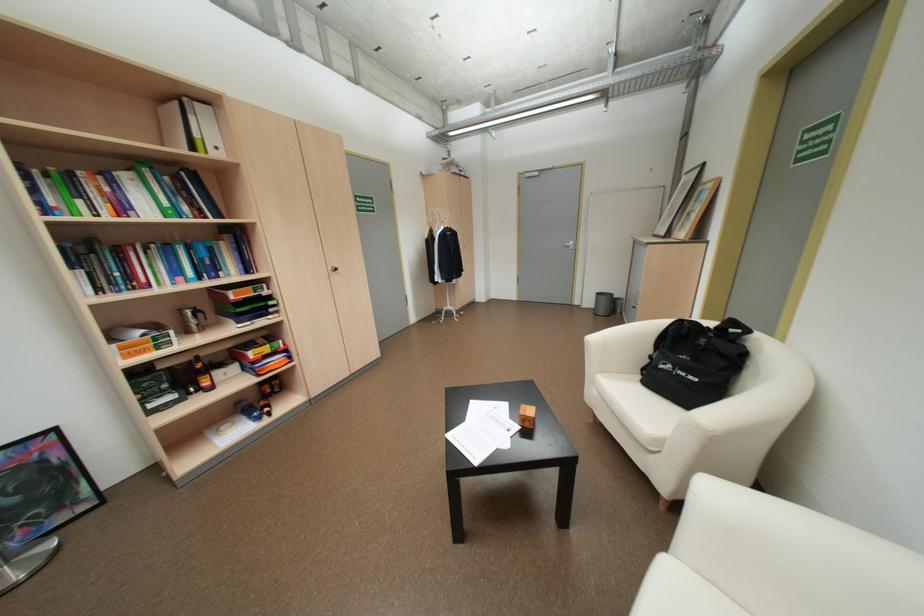
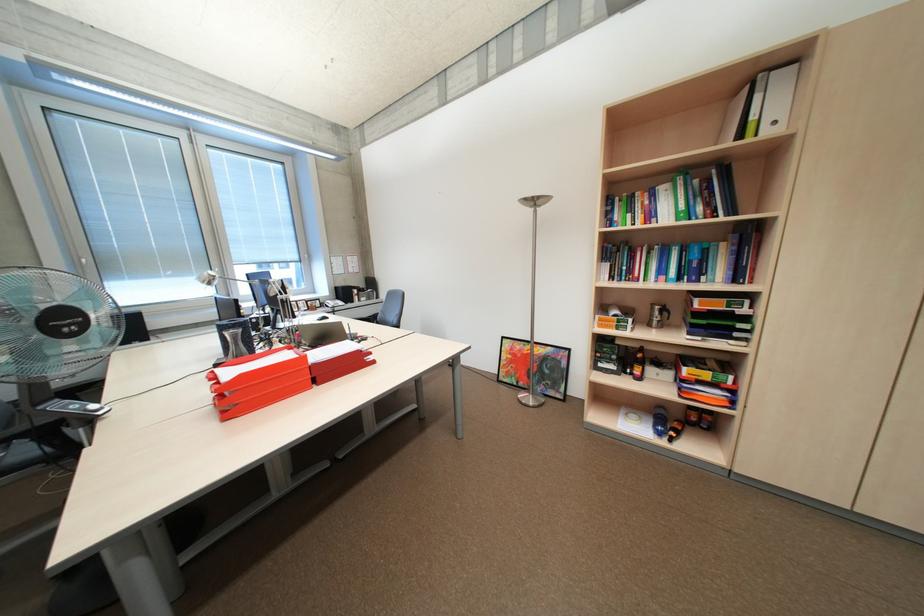
Locate, in the second image, the point that corresponds to point 202,148 in the first image.

(749, 136)